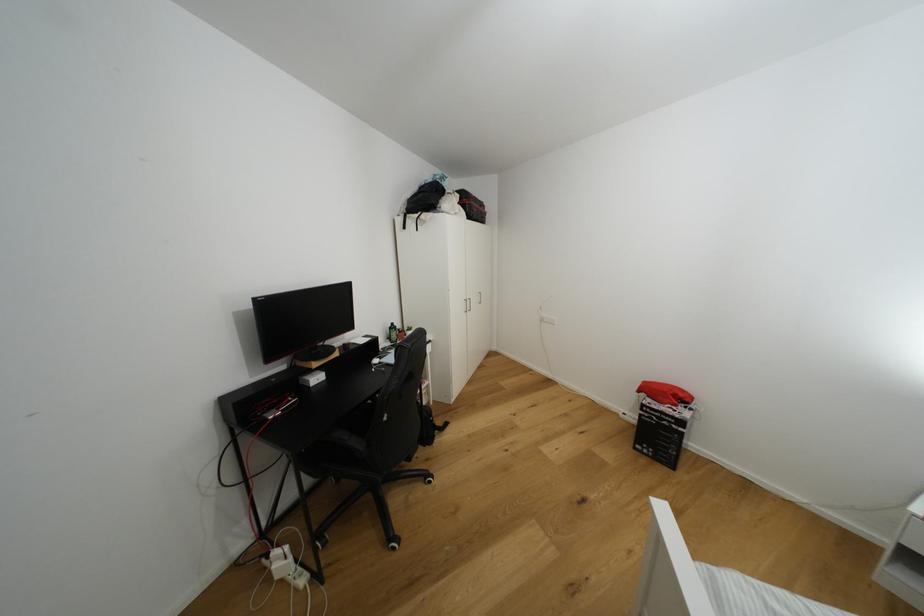
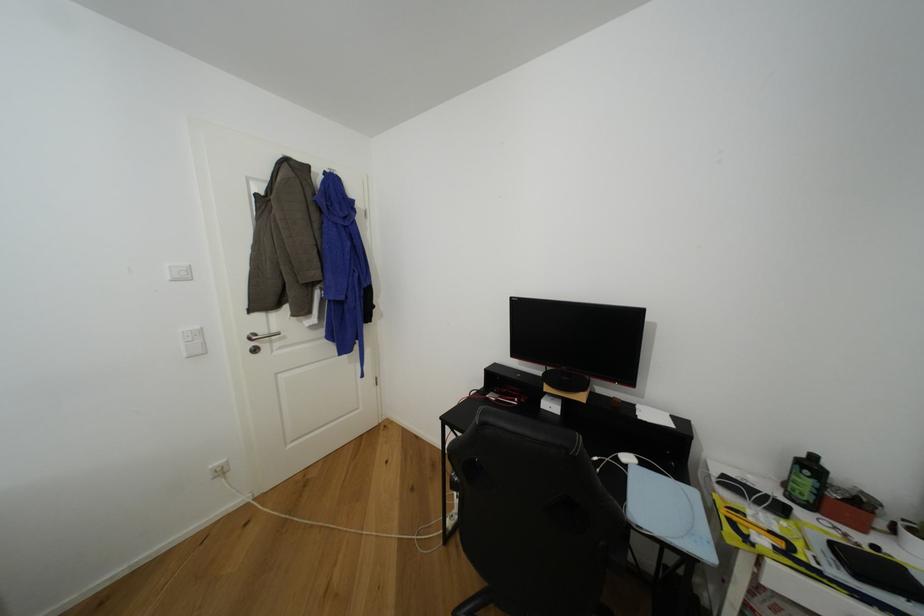
Locate, in the second image, the point that corresponds to pixel 397 325 in the first image.

(820, 459)